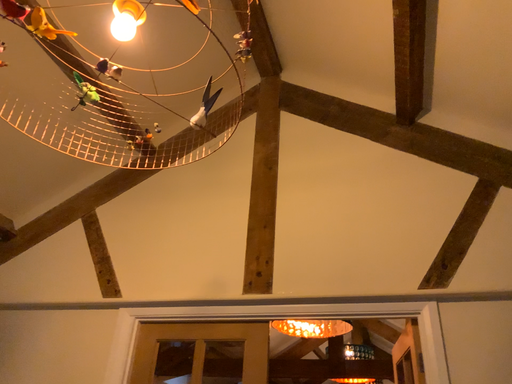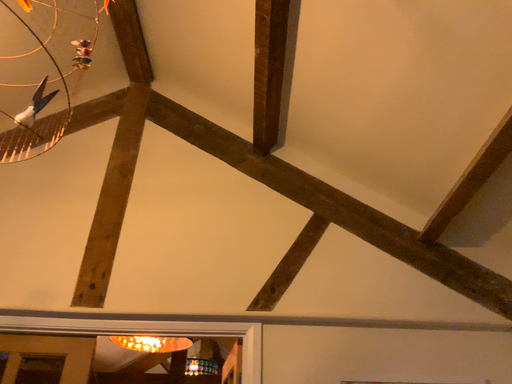
Question: How did the camera likely rotate when shooting the video?

Choices:
 (A) rotated left
 (B) rotated right

Answer: (B)